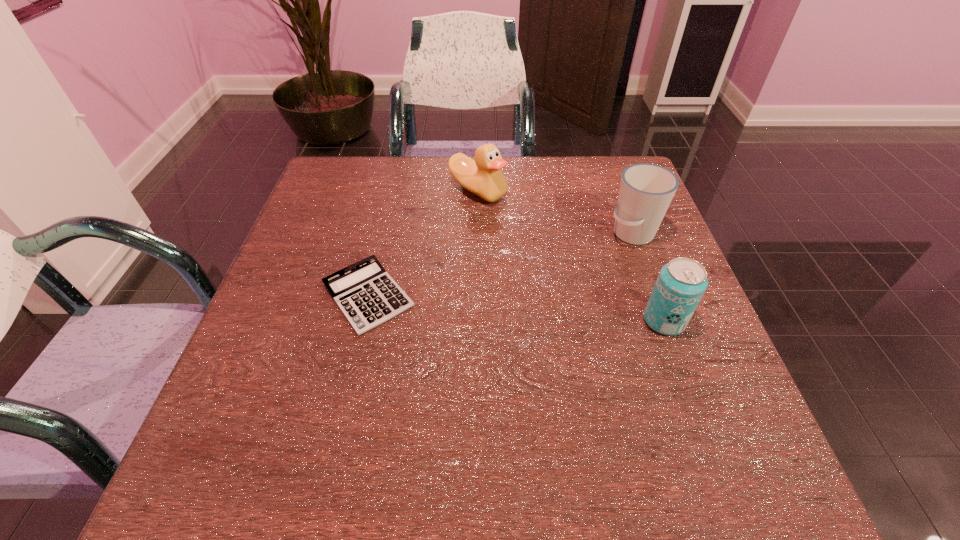
In order to click on free spot between the shortest object and the beer can in this screenshot , I will do `click(516, 308)`.

At what (x,y) coordinates should I click in order to perform the action: click on free spot between the shortest object and the third nearest object. Please return your answer as a coordinate pair (x, y). Looking at the image, I should click on (500, 265).

The image size is (960, 540). In order to click on vacant space that's between the beer can and the second farthest object in this screenshot , I will do `click(648, 278)`.

Identify the location of vacant region between the farthest object and the leftmost object. (423, 244).

Select which object is the closest to the shortest object. Please provide its 2D coordinates. Your answer should be formatted as a tuple, i.e. [(x, y)], where the tuple contains the x and y coordinates of a point satisfying the conditions above.

[(483, 176)]

Identify the location of object that is the second closest to the beer can. The height and width of the screenshot is (540, 960). (483, 176).

Where is `free space that satisfies the following two spatial constraints: 1. on the front side of the duck; 2. on the right side of the beer can`? free space that satisfies the following two spatial constraints: 1. on the front side of the duck; 2. on the right side of the beer can is located at coordinates (477, 321).

This screenshot has width=960, height=540. Find the location of `vacant region that satisfies the following two spatial constraints: 1. on the front side of the second object from left to right; 2. on the left side of the beer can`. vacant region that satisfies the following two spatial constraints: 1. on the front side of the second object from left to right; 2. on the left side of the beer can is located at coordinates (477, 321).

This screenshot has width=960, height=540. Identify the location of free space that satisfies the following two spatial constraints: 1. on the front side of the beer can; 2. on the left side of the third object from right to left. (477, 321).

Identify the location of free space in the image that satisfies the following two spatial constraints: 1. on the back side of the second farthest object; 2. on the right side of the shortest object. (383, 234).